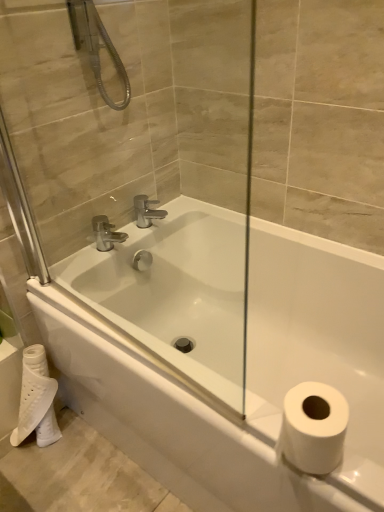
In order to click on vacant space in transparent glass door at center (from a real-world perspective) in this screenshot , I will do `click(126, 344)`.